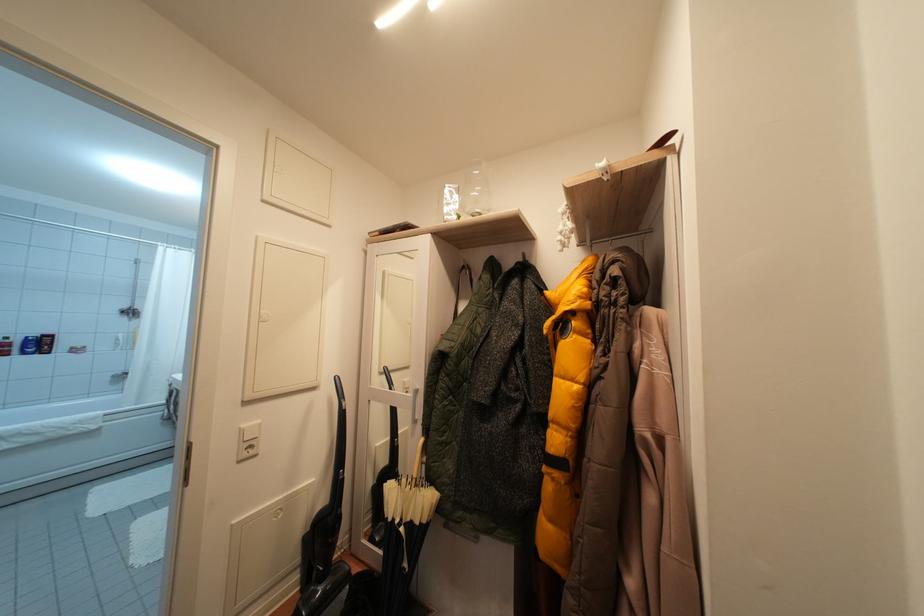
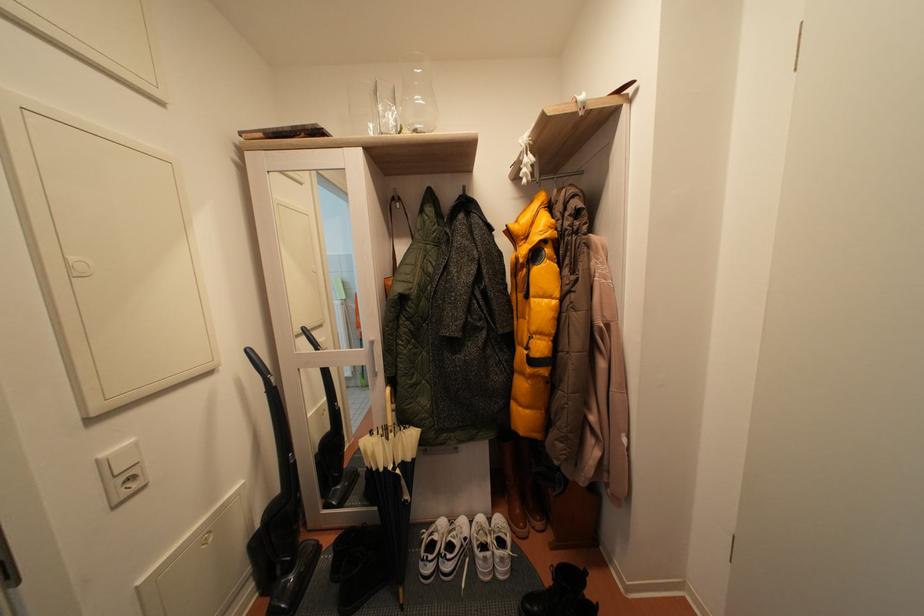
Locate, in the second image, the point that corresponds to point (250, 431) in the first image.

(111, 460)